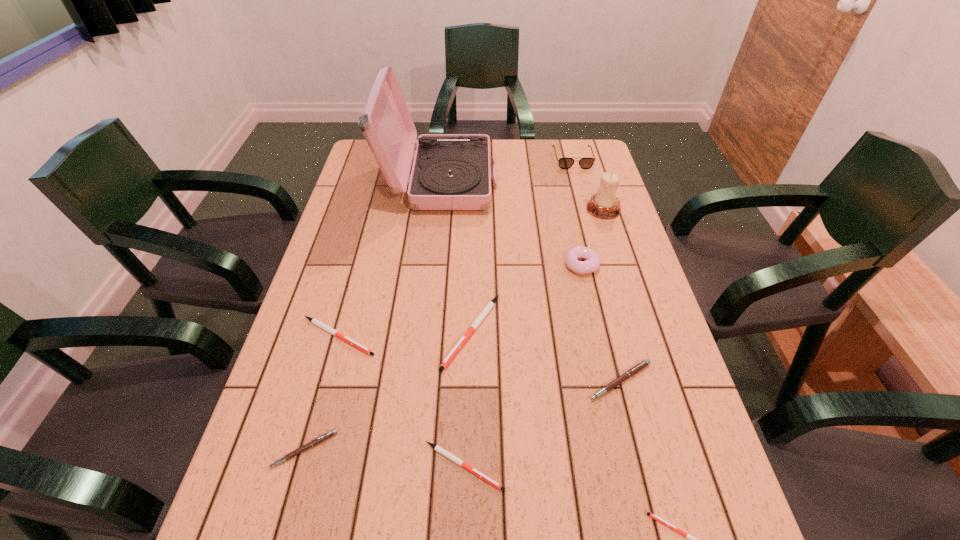
Locate an element on the screen. the tallest object is located at coordinates (450, 171).

The image size is (960, 540). In order to click on the second tallest object in this screenshot , I will do `click(604, 204)`.

Locate an element on the screen. white candle holder is located at coordinates (x=604, y=204).

The width and height of the screenshot is (960, 540). In order to click on spectacles in this screenshot , I will do `click(564, 163)`.

This screenshot has width=960, height=540. In order to click on black spectacles in this screenshot , I will do `click(564, 163)`.

Where is `purple doughnut`? Image resolution: width=960 pixels, height=540 pixels. purple doughnut is located at coordinates (592, 263).

Locate an element on the screen. The height and width of the screenshot is (540, 960). doughnut is located at coordinates (592, 263).

In order to click on the biggest white pen in this screenshot , I will do `click(489, 306)`.

Locate an element on the screen. This screenshot has width=960, height=540. the farther pink pen is located at coordinates (637, 368).

The height and width of the screenshot is (540, 960). Identify the location of the right pink pen. (637, 368).